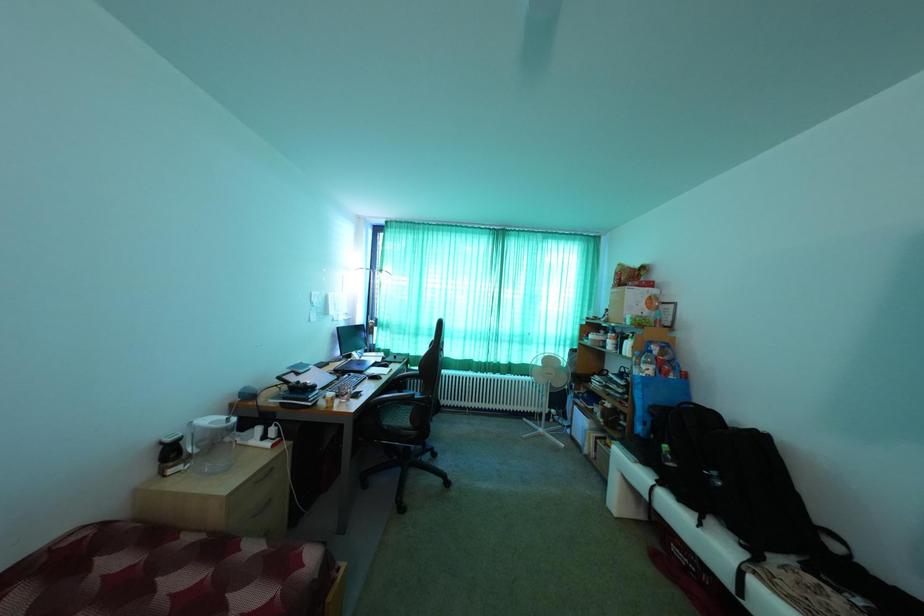
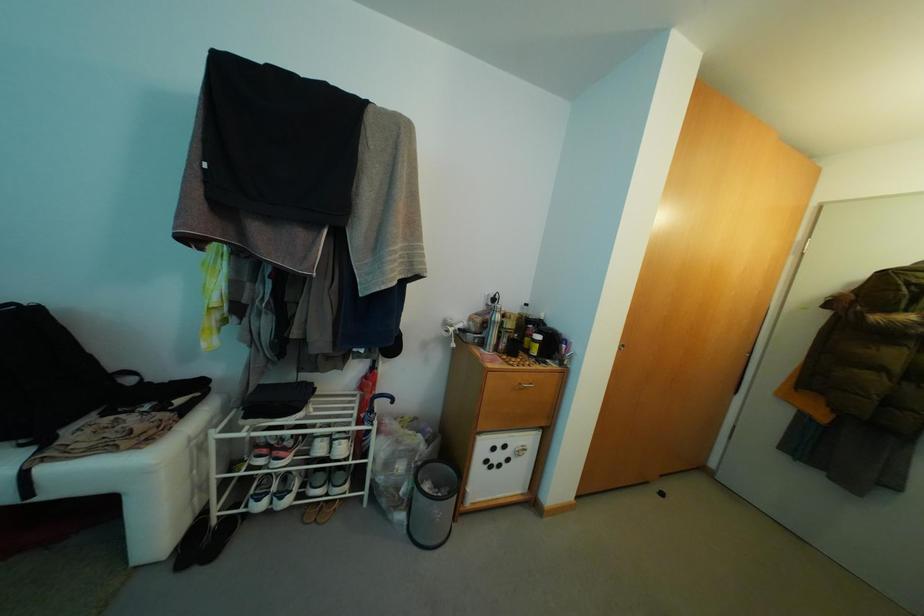
Question: The camera is either moving clockwise (left) or counter-clockwise (right) around the object. The first image is from the beginning of the video and the second image is from the end. Is the camera moving left or right when shooting the video?

Choices:
 (A) Left
 (B) Right

Answer: (A)